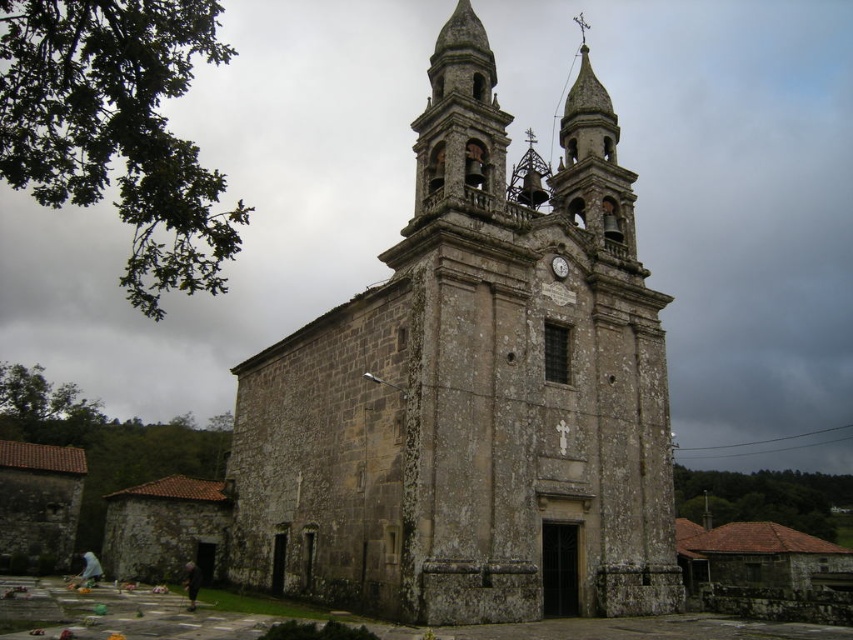
Question: Can you confirm if stone bell tower at center is smaller than metallic clock at center?

Choices:
 (A) yes
 (B) no

Answer: (B)

Question: Can you confirm if polished bronze bell at upper center is thinner than metallic clock at center?

Choices:
 (A) yes
 (B) no

Answer: (B)

Question: Which point appears farthest from the camera in this image?

Choices:
 (A) (587, 292)
 (B) (419, 134)
 (C) (532, 168)
 (D) (566, 276)

Answer: (C)

Question: Can you confirm if stone church at center is positioned to the right of stone bell tower at center?

Choices:
 (A) no
 (B) yes

Answer: (A)

Question: Considering the real-world distances, which object is closest to the polished bronze bell at upper center?

Choices:
 (A) metallic clock at center
 (B) stone bell tower at center

Answer: (B)

Question: Among these objects, which one is nearest to the camera?

Choices:
 (A) metallic clock at center
 (B) stone bell tower at center

Answer: (B)